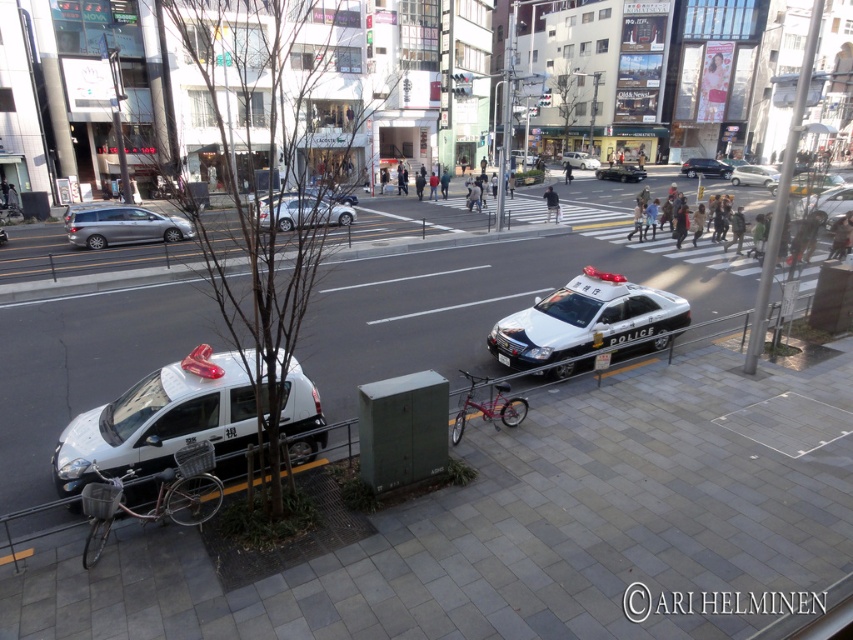
You are a pedestrian waiting at the crosswalk in the middle of the street. You see a white glossy police car at center and a white glossy sedan at center. Which vehicle is directly above the other?

The white glossy police car at center is positioned under the white glossy sedan at center, so the white glossy sedan at center is directly above the police car.

You are standing at the crosswalk in the middle of the urban street scene. You want to locate the matte black sedan at center. According to the coordinates provided, where exactly should you look to find it?

The matte black sedan at center is located at the 2D coordinates point (705, 168). Since coordinates typically range from 0 to 1, this places it approximately 26.3 percent from the left edge and 82.8 percent from the top edge of the image.